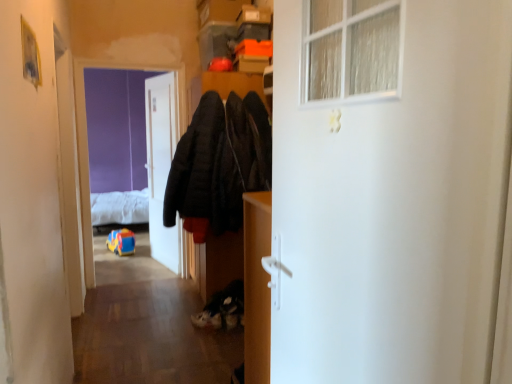
Locate an element on the screen. free space to the left of white glossy door at center, which ranks as the second door in front-to-back order is located at coordinates (139, 264).